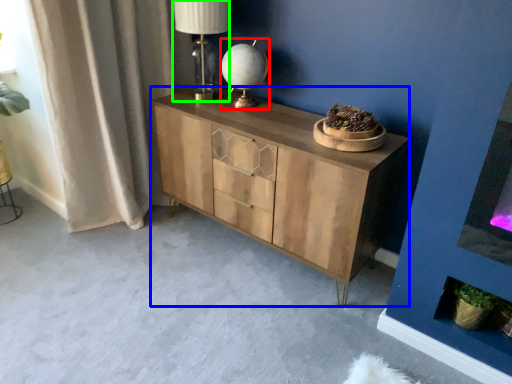
Question: Considering the real-world distances, which object is closest to table lamp (highlighted by a red box)? chest of drawers (highlighted by a blue box) or table lamp (highlighted by a green box).

Choices:
 (A) chest of drawers
 (B) table lamp

Answer: (B)